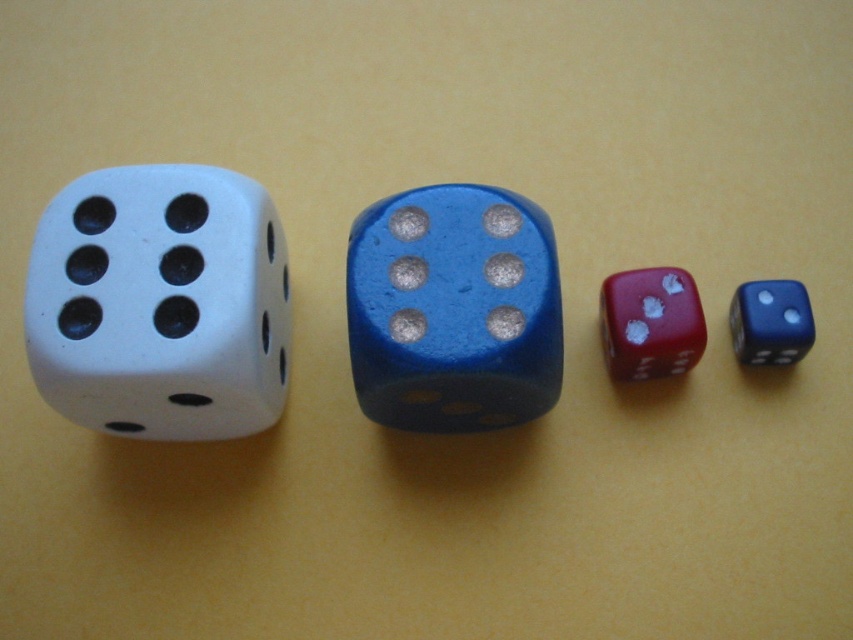
Who is more forward, (627, 371) or (73, 280)?

Positioned in front is point (73, 280).

Is matte white dice at left above matte white die at left?

No.

Does point (403, 260) lie in front of point (105, 401)?

No.

Image resolution: width=853 pixels, height=640 pixels. In order to click on matte white dice at left in this screenshot , I will do `click(161, 304)`.

Does point (614, 342) come farther from viewer compared to point (759, 324)?

Yes, it is.

Is rubberized red dice at center right to the right of shiny blue die at right from the viewer's perspective?

In fact, rubberized red dice at center right is to the left of shiny blue die at right.

Is point (664, 362) less distant than point (776, 323)?

No, it is behind (776, 323).

The width and height of the screenshot is (853, 640). In order to click on rubberized red dice at center right in this screenshot , I will do `click(650, 323)`.

Does point (490, 280) come behind point (534, 262)?

No, it is in front of (534, 262).

Can you confirm if matte white dice at left is positioned below blue glossy die at center?

Yes.

Where is `matte white dice at left`? matte white dice at left is located at coordinates (161, 304).